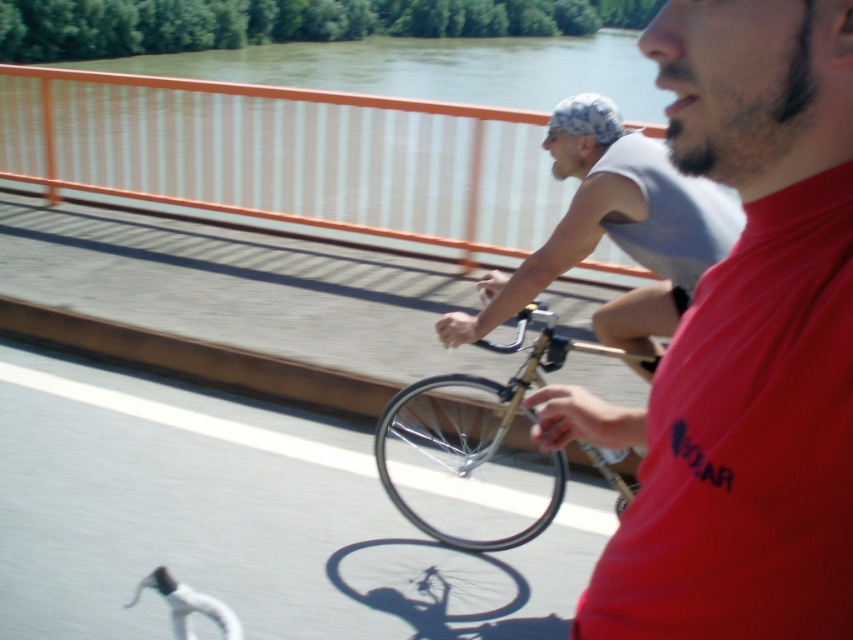
You are a photographer trying to capture the gold metallic bicycle at center and the shiny metallic bicycle wheel at center in a single shot. Given that your camera can only focus on objects wider than 10 cm, will both objects be in focus?

The gold metallic bicycle at center is wider than the shiny metallic bicycle wheel at center. Since the camera focuses on objects wider than 10 cm, both objects will be in focus as their widths exceed the minimum requirement.